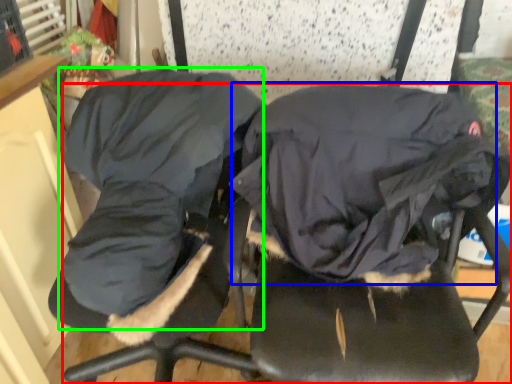
Question: Which object is the closest to the chair (highlighted by a red box)? Choose among these: sleeping bag (highlighted by a blue box) or clothing (highlighted by a green box).

Choices:
 (A) sleeping bag
 (B) clothing

Answer: (A)